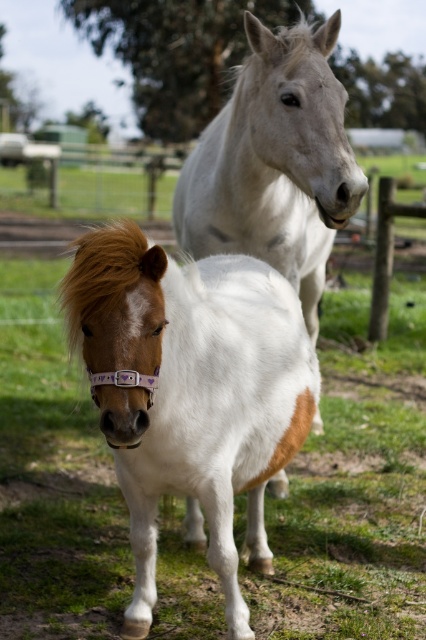
Does white glossy pony at center have a smaller size compared to white glossy horse at upper center?

Yes.

Does white glossy pony at center appear on the right side of white glossy horse at upper center?

Incorrect, white glossy pony at center is not on the right side of white glossy horse at upper center.

Locate an element on the screen. white glossy pony at center is located at coordinates (190, 392).

Image resolution: width=426 pixels, height=640 pixels. In order to click on white glossy pony at center in this screenshot , I will do `click(190, 392)`.